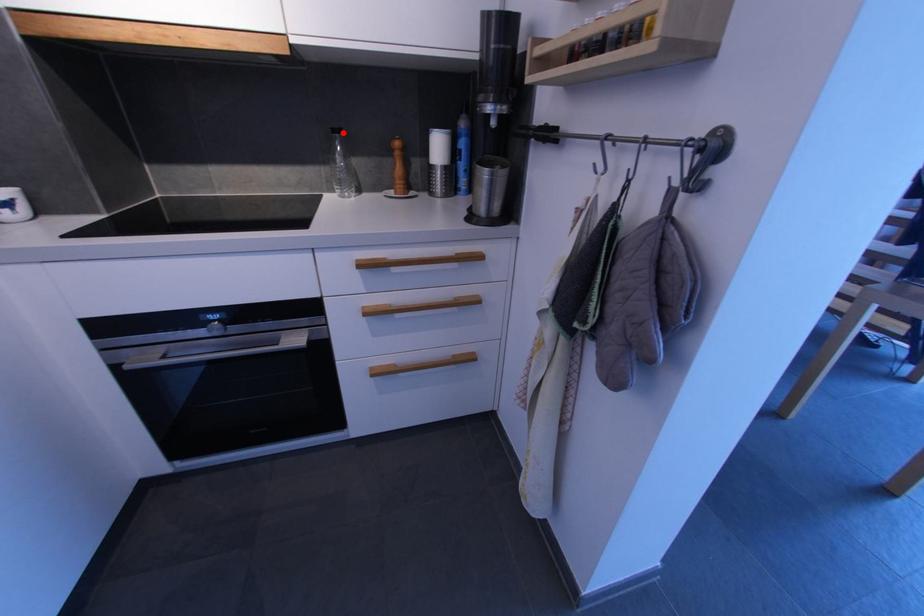
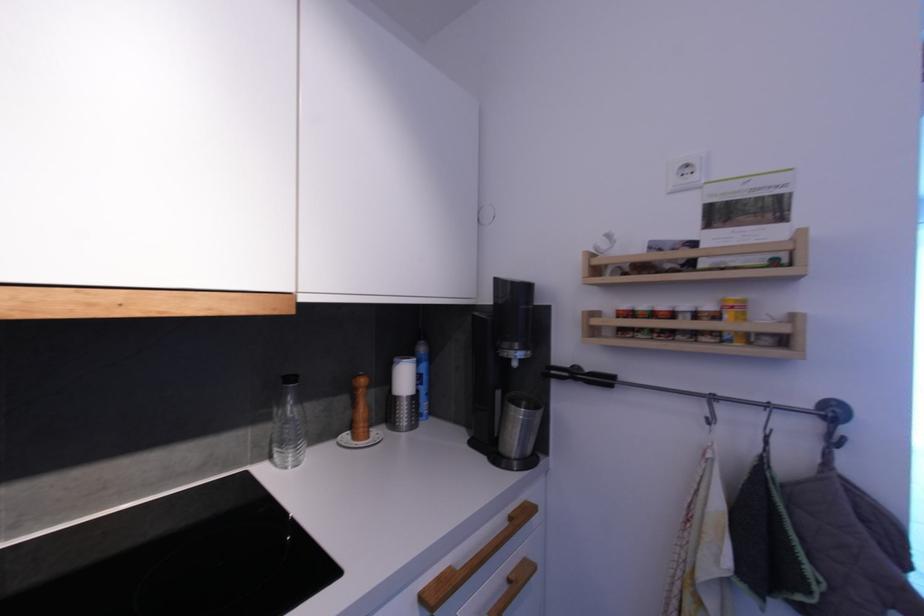
Locate, in the second image, the point that corresponds to the highlighted location in the first image.

(295, 381)